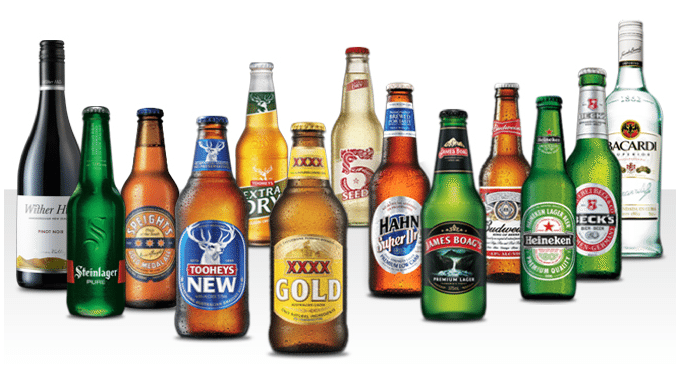
Locate an element on the screen. This screenshot has height=366, width=677. bottles with brown liquid is located at coordinates (150, 201), (322, 222), (202, 215), (259, 159), (508, 170), (399, 188).